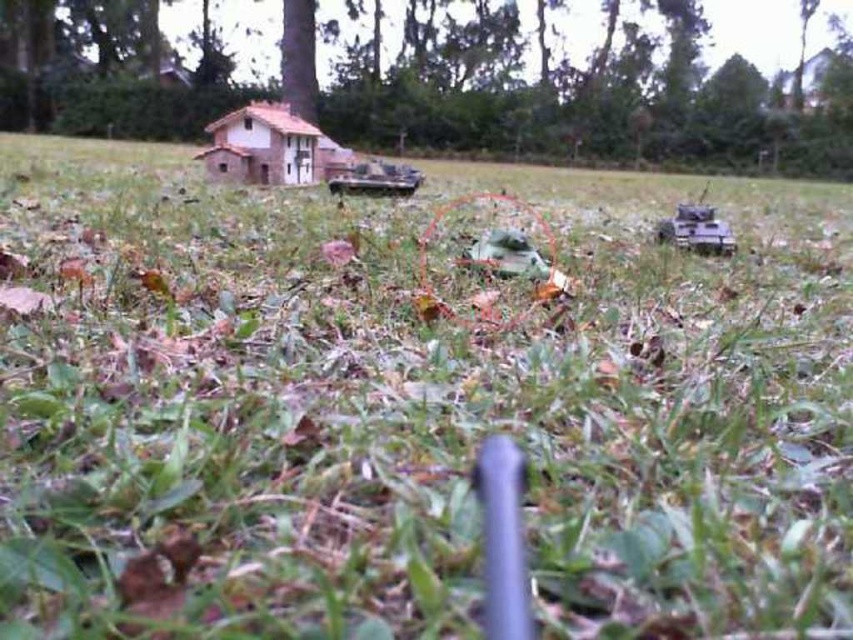
Does green matte tree at upper center appear over green matte toy car at center?

Correct, green matte tree at upper center is located above green matte toy car at center.

Is green matte tree at upper center to the left of green matte toy car at center from the viewer's perspective?

Indeed, green matte tree at upper center is positioned on the left side of green matte toy car at center.

The width and height of the screenshot is (853, 640). Find the location of `green matte tree at upper center`. green matte tree at upper center is located at coordinates (299, 58).

Where is `green matte tree at upper center`? green matte tree at upper center is located at coordinates (299, 58).

Is green matte tree at upper center bigger than metallic gray tank at center?

Indeed, green matte tree at upper center has a larger size compared to metallic gray tank at center.

At what (x,y) coordinates should I click in order to perform the action: click on green matte tree at upper center. Please return your answer as a coordinate pair (x, y). Looking at the image, I should click on (299, 58).

Which is in front, point (634, 58) or point (519, 273)?

Point (519, 273)

Between brown wood tree at upper center and green matte toy car at center, which one is positioned higher?

brown wood tree at upper center is higher up.

Is point (715, 148) in front of point (527, 243)?

That is False.

What are the coordinates of `brown wood tree at upper center` in the screenshot? It's located at (589, 93).